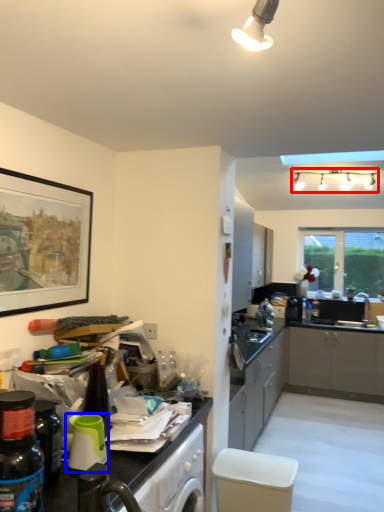
Question: Which object is further to the camera taking this photo, light fixture (highlighted by a red box) or appliance (highlighted by a blue box)?

Choices:
 (A) light fixture
 (B) appliance

Answer: (A)